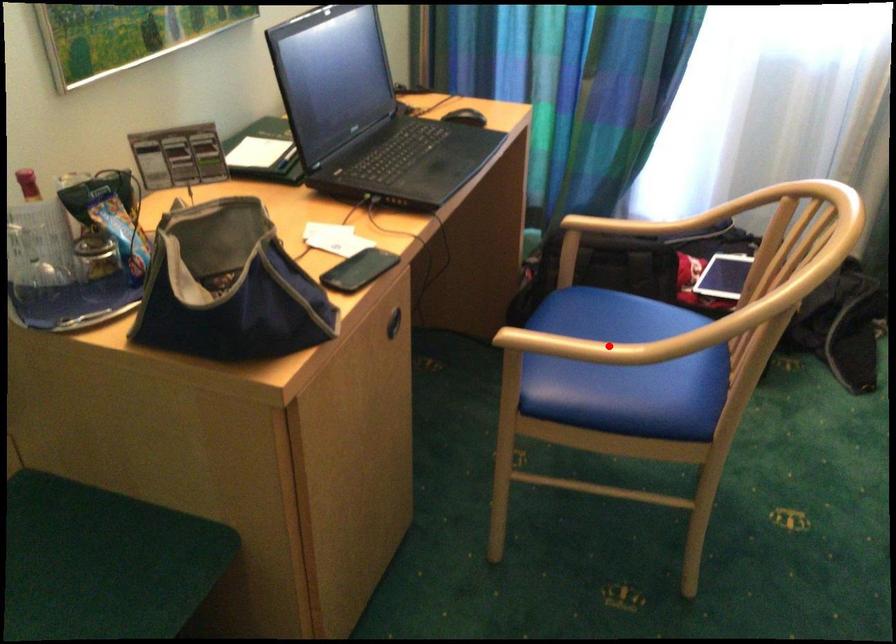
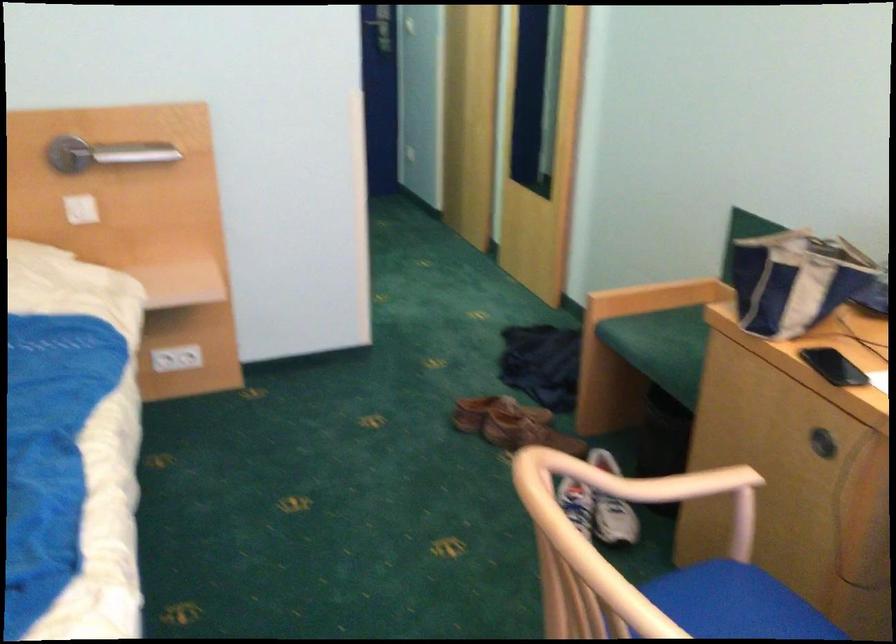
In the second image, find the point that corresponds to the highlighted location in the first image.

(677, 507)